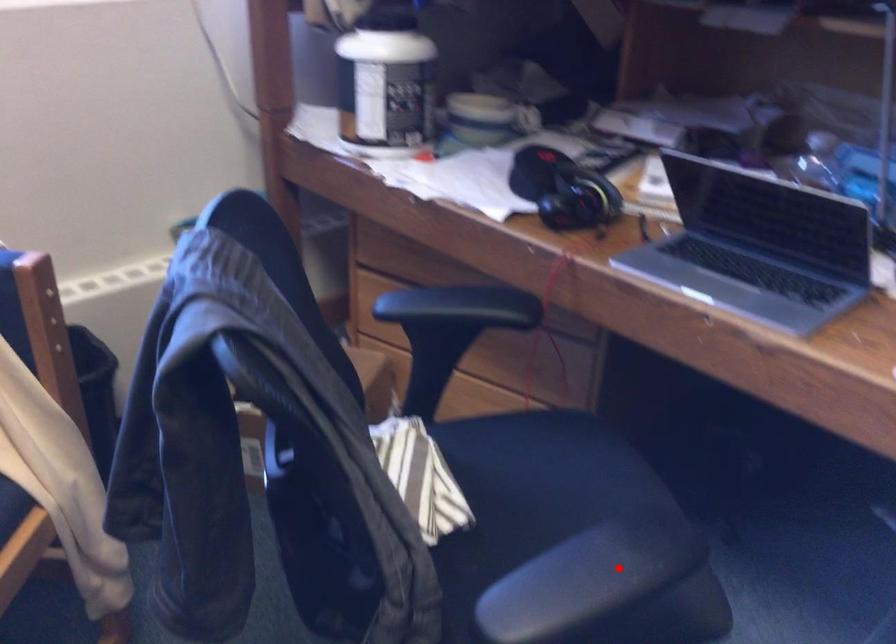
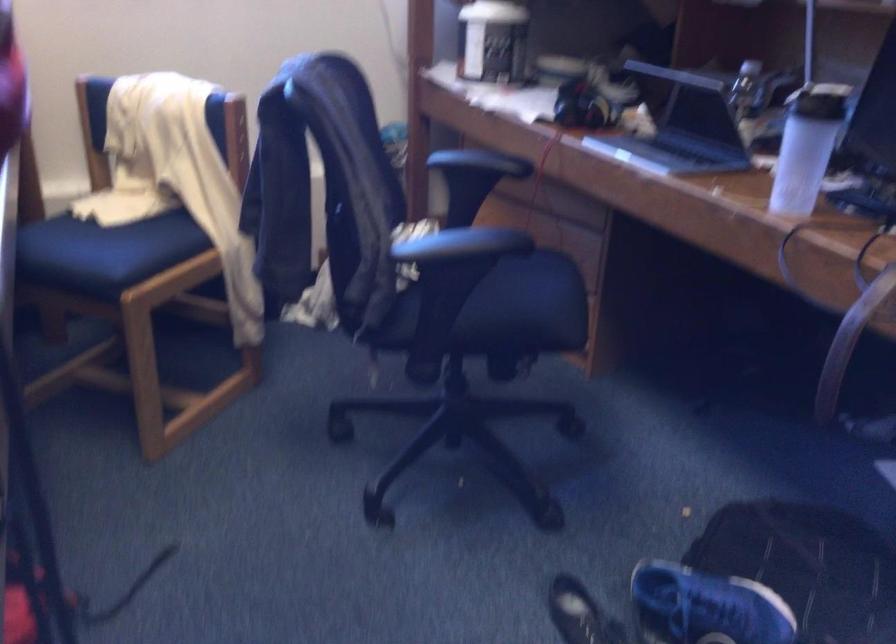
In the second image, find the point that corresponds to the highlighted location in the first image.

(471, 242)